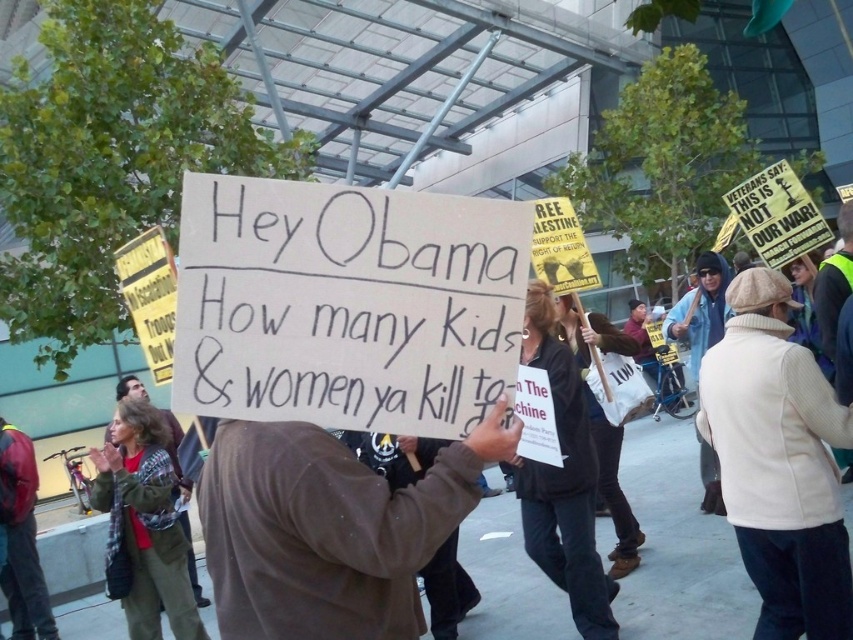
Question: Which of the following is the farthest from the observer?

Choices:
 (A) green plaid shirt at center
 (B) dark brown leather jacket at lower left

Answer: (B)

Question: Can you confirm if dark brown leather jacket at lower left is bigger than green plaid shirt at center?

Choices:
 (A) no
 (B) yes

Answer: (A)

Question: Considering the relative positions of dark brown leather jacket at lower left and green plaid shirt at center in the image provided, where is dark brown leather jacket at lower left located with respect to green plaid shirt at center?

Choices:
 (A) below
 (B) above

Answer: (A)

Question: Is dark brown leather jacket at lower left positioned at the back of green plaid shirt at center?

Choices:
 (A) no
 (B) yes

Answer: (B)

Question: Which of the following is the closest to the observer?

Choices:
 (A) dark brown leather jacket at lower left
 (B) green plaid shirt at center

Answer: (B)